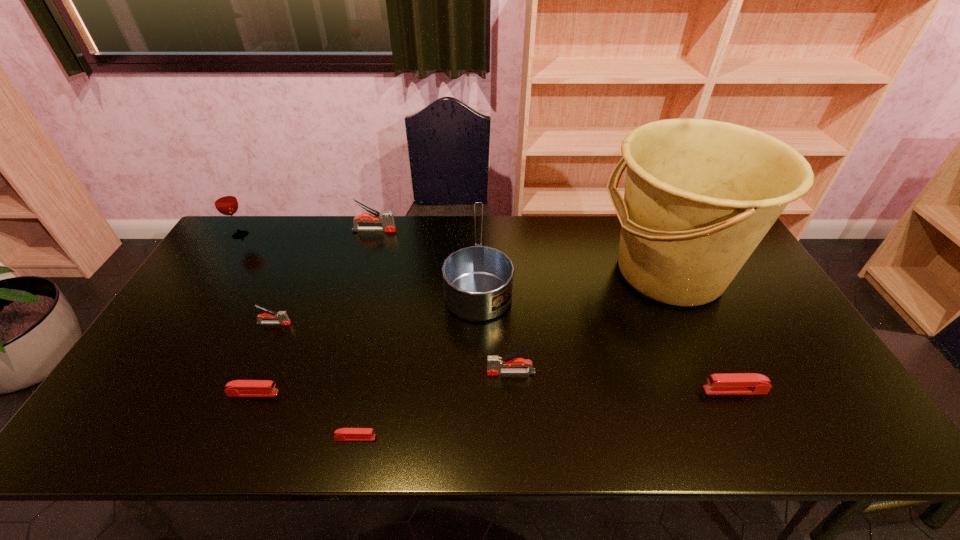
At what (x,y) coordinates should I click in order to perform the action: click on vacant space located 0.100m on the handle side of the second gray stapler from left to right. Please return your answer as a coordinate pair (x, y). The width and height of the screenshot is (960, 540). Looking at the image, I should click on (424, 230).

At what (x,y) coordinates should I click in order to perform the action: click on free location located 0.190m on the handle side of the fifth shortest object. Please return your answer as a coordinate pair (x, y). The height and width of the screenshot is (540, 960). Looking at the image, I should click on (412, 373).

Locate an element on the screen. The width and height of the screenshot is (960, 540). blank space located on the handle side of the fifth shortest object is located at coordinates (432, 373).

The height and width of the screenshot is (540, 960). In order to click on free space located on the handle side of the fifth shortest object in this screenshot , I will do `click(376, 373)`.

Identify the location of free point located 0.220m on the handle side of the sixth tallest object. The height and width of the screenshot is (540, 960). (370, 323).

What are the coordinates of `vacant region located on the front-facing side of the biggest red stapler` in the screenshot? It's located at (602, 390).

What are the coordinates of `vacant space located 0.090m on the front-facing side of the biggest red stapler` in the screenshot? It's located at (667, 390).

I want to click on blank area located on the front-facing side of the biggest red stapler, so coord(659,390).

You are a GUI agent. You are given a task and a screenshot of the screen. Output one action in this format:
    pyautogui.click(x=<x>, y=<y>)
    Task: Click on the free spot located on the front-facing side of the second smallest red stapler
    This screenshot has width=960, height=540.
    Given the screenshot: What is the action you would take?
    pyautogui.click(x=390, y=393)

Where is `vacant space located on the front-facing side of the second red stapler from right to left`? The height and width of the screenshot is (540, 960). vacant space located on the front-facing side of the second red stapler from right to left is located at coordinates (434, 438).